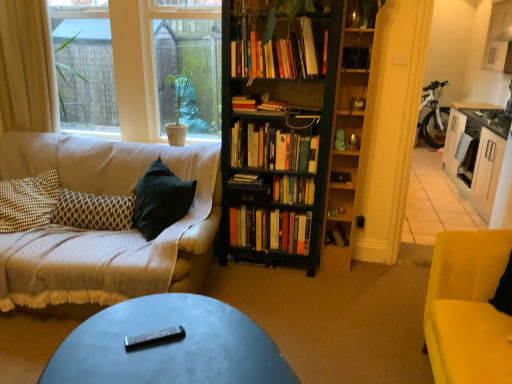
The height and width of the screenshot is (384, 512). Identify the location of vacant point above metallic gray coffee table at center (from a real-world perspective). (166, 340).